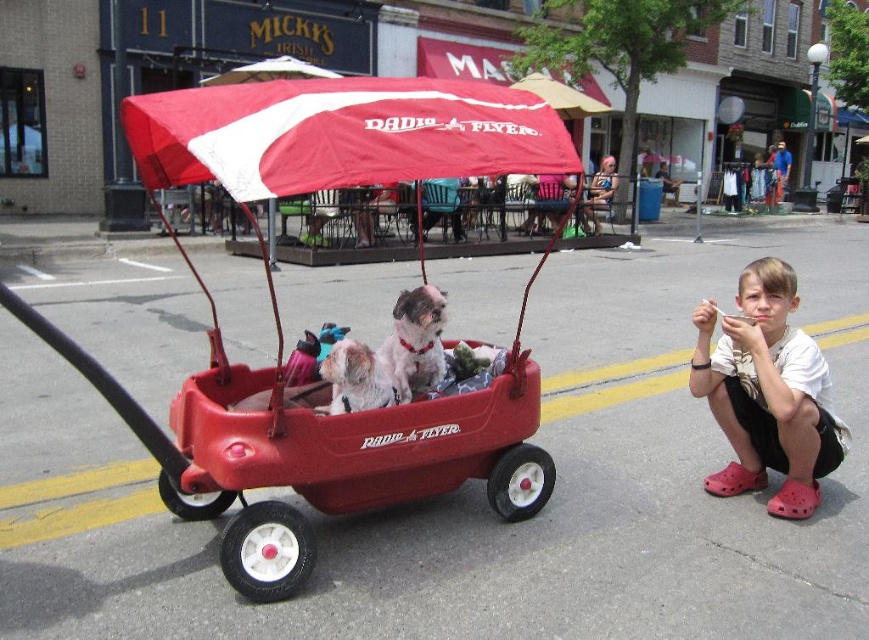
Is point (528, 448) behind point (422, 288)?

That is False.

Is matte plastic wagon at center shorter than white fluffy dog at center?

Incorrect, matte plastic wagon at center's height does not fall short of white fluffy dog at center's.

Is point (359, 92) positioned in front of point (428, 333)?

Yes.

At what (x,y) coordinates should I click in order to perform the action: click on matte plastic wagon at center. Please return your answer as a coordinate pair (x, y). This screenshot has height=640, width=869. Looking at the image, I should click on (279, 317).

Who is shorter, pink croc shoes at lower right or white fur dog at center?

white fur dog at center is shorter.

Which is more to the left, pink croc shoes at lower right or white fur dog at center?

white fur dog at center is more to the left.

Find the location of a particular element. pink croc shoes at lower right is located at coordinates (767, 392).

Can you confirm if white fluffy dog at center is shorter than white fur dog at center?

Incorrect, white fluffy dog at center's height does not fall short of white fur dog at center's.

Consider the image. Can you confirm if white fluffy dog at center is thinner than white fur dog at center?

Yes, white fluffy dog at center is thinner than white fur dog at center.

Find the location of `white fluffy dog at center`. white fluffy dog at center is located at coordinates coord(415,340).